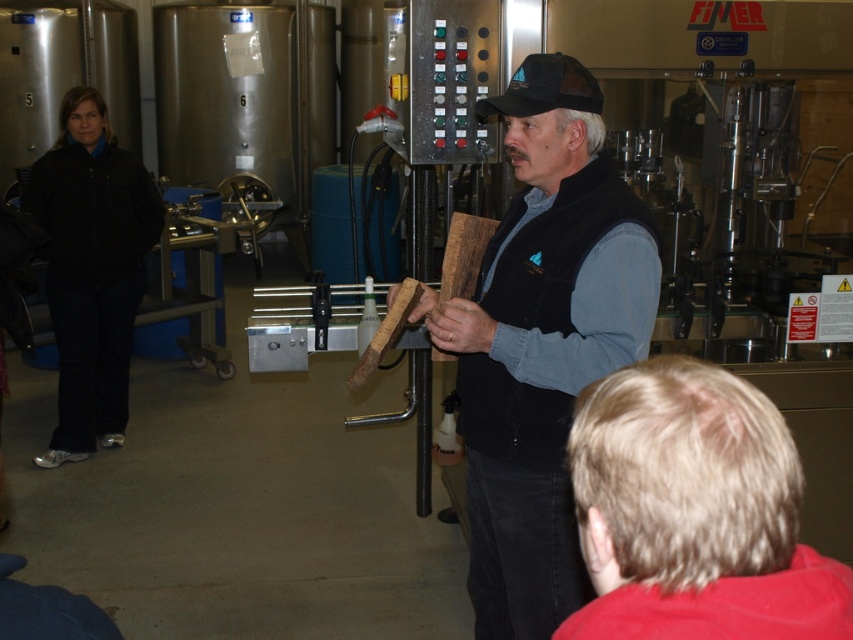
Measure the distance between wooden plank at center and blonde hair at lower right.

wooden plank at center is 37.45 inches away from blonde hair at lower right.

Can you confirm if wooden plank at center is taller than blonde hair at lower right?

Indeed, wooden plank at center has a greater height compared to blonde hair at lower right.

Does point (508, 524) lie in front of point (769, 513)?

No, it is not.

Identify the location of wooden plank at center. (543, 340).